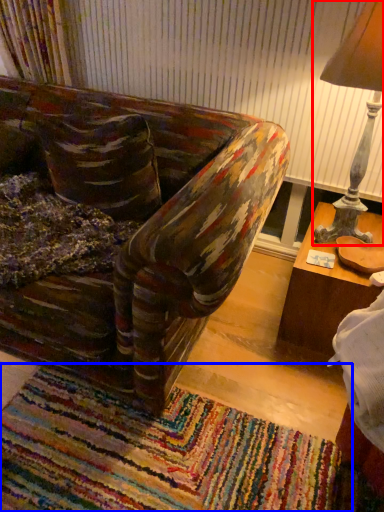
Question: Which point is further to the camera, table lamp (highlighted by a red box) or mat (highlighted by a blue box)?

Choices:
 (A) table lamp
 (B) mat

Answer: (A)